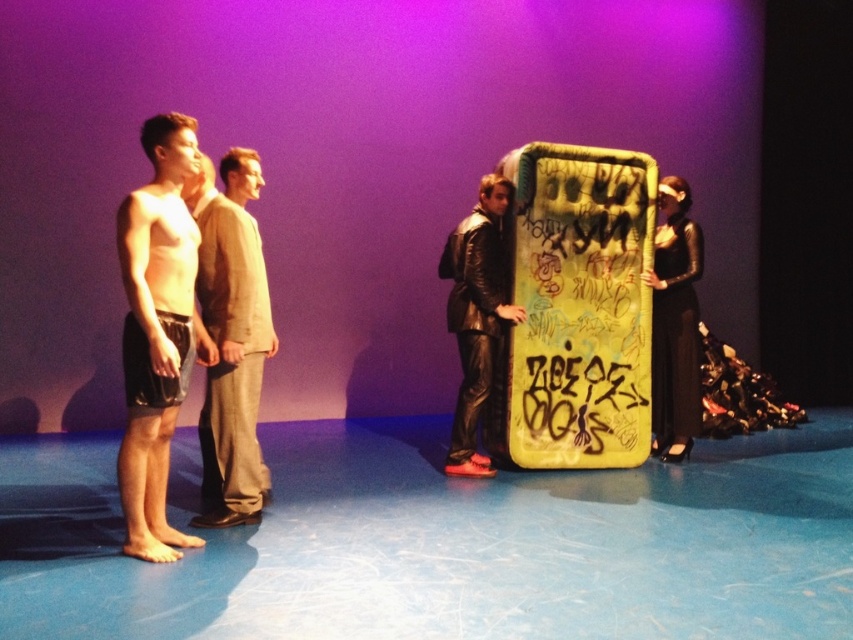
Question: Which point appears farthest from the camera in this image?

Choices:
 (A) (457, 396)
 (B) (668, 228)
 (C) (265, 298)
 (D) (189, 364)

Answer: (B)

Question: Estimate the real-world distances between objects in this image. Which object is farther from the black leather dress at right?

Choices:
 (A) beige fabric pants at center
 (B) leather jacket at center
 (C) shiny black shorts at left

Answer: (C)

Question: Which of the following is the closest to the observer?

Choices:
 (A) (177, 257)
 (B) (253, 253)

Answer: (A)

Question: Considering the relative positions of beige fabric pants at center and black leather dress at right in the image provided, where is beige fabric pants at center located with respect to black leather dress at right?

Choices:
 (A) below
 (B) above

Answer: (A)

Question: Observing the image, what is the correct spatial positioning of beige fabric pants at center in reference to leather jacket at center?

Choices:
 (A) below
 (B) above

Answer: (A)

Question: Is beige fabric pants at center positioned behind leather jacket at center?

Choices:
 (A) yes
 (B) no

Answer: (B)